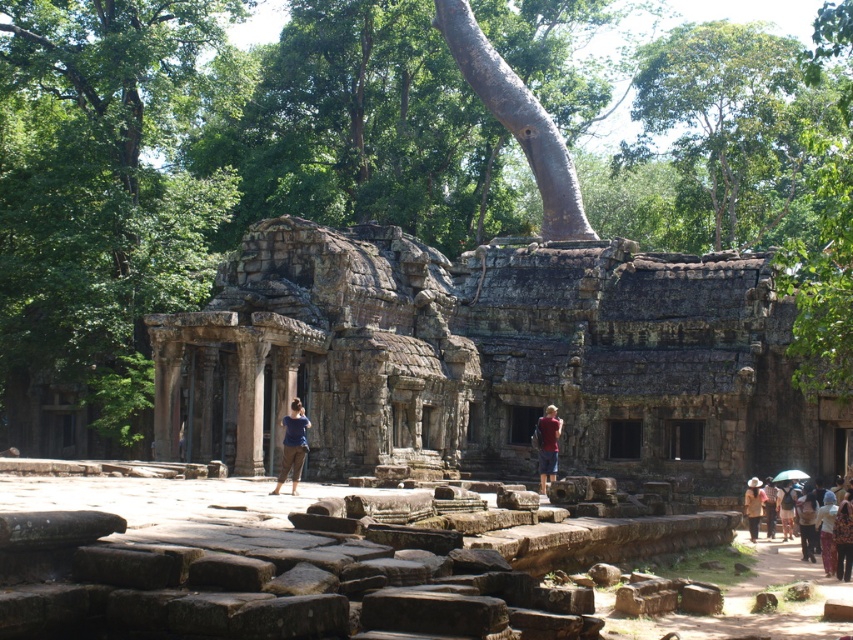
You are standing in front of the ancient stone structure and notice a red shirt at center and a green leafy tree at upper center. From your perspective, which object is positioned higher?

The green leafy tree at upper center is located above the red shirt at center, so it is positioned higher.

You are observing two people wearing shirts in the scene. The blue fabric shirt at center and the red shirt at center are both visible. Which person is shorter?

The blue fabric shirt at center has a lesser height compared to the red shirt at center, so the person wearing the blue fabric shirt at center is shorter.

You are standing in front of the ancient stone structure and notice a green leafy tree at upper center and a person wearing a red shirt at center. Which object is higher in the scene?

The green leafy tree at upper center is taller than the red shirt at center, so the green leafy tree at upper center is higher in the scene.